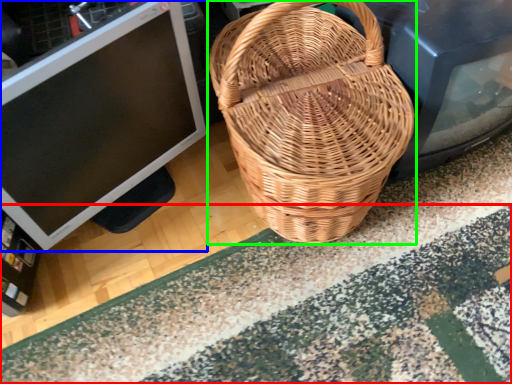
Question: Which object is the farthest from doormat (highlighted by a red box)? Choose among these: computer monitor (highlighted by a blue box) or picnic basket (highlighted by a green box).

Choices:
 (A) computer monitor
 (B) picnic basket

Answer: (A)